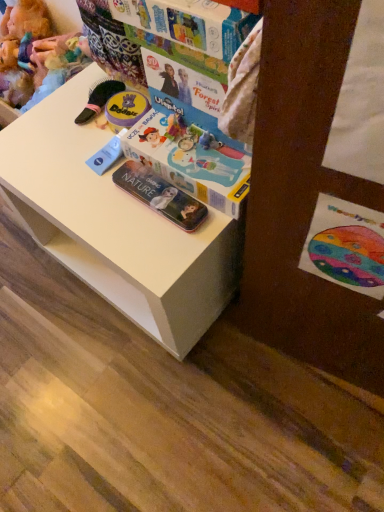
Question: From a real-world perspective, is multicolored cardboard book at upper center on transparent plastic case at lower center?

Choices:
 (A) no
 (B) yes

Answer: (B)

Question: From a real-world perspective, does multicolored cardboard book at upper center sit lower than transparent plastic case at lower center?

Choices:
 (A) no
 (B) yes

Answer: (A)

Question: Is multicolored cardboard book at upper center placed right next to transparent plastic case at lower center?

Choices:
 (A) yes
 (B) no

Answer: (B)

Question: Would you consider multicolored cardboard book at upper center to be distant from transparent plastic case at lower center?

Choices:
 (A) no
 (B) yes

Answer: (A)

Question: Considering the relative sizes of multicolored cardboard book at upper center and transparent plastic case at lower center in the image provided, is multicolored cardboard book at upper center shorter than transparent plastic case at lower center?

Choices:
 (A) no
 (B) yes

Answer: (A)

Question: Considering their positions, is multicolored cardboard book at upper center located in front of or behind transparent plastic case at lower center?

Choices:
 (A) behind
 (B) front

Answer: (B)

Question: Which is correct: multicolored cardboard book at upper center is inside transparent plastic case at lower center, or outside of it?

Choices:
 (A) outside
 (B) inside

Answer: (A)

Question: Is point (226, 12) closer or farther from the camera than point (147, 187)?

Choices:
 (A) closer
 (B) farther

Answer: (A)

Question: From the image's perspective, is multicolored cardboard book at upper center positioned above or below transparent plastic case at lower center?

Choices:
 (A) below
 (B) above

Answer: (B)

Question: From a real-world perspective, is white plastic changing table at center above or below multicolored cardboard book at upper center?

Choices:
 (A) below
 (B) above

Answer: (A)

Question: From the image's perspective, relative to multicolored cardboard book at upper center, is white plastic changing table at center above or below?

Choices:
 (A) below
 (B) above

Answer: (A)

Question: Is white plastic changing table at center in front of or behind multicolored cardboard book at upper center in the image?

Choices:
 (A) front
 (B) behind

Answer: (B)

Question: Based on their sizes in the image, would you say white plastic changing table at center is bigger or smaller than multicolored cardboard book at upper center?

Choices:
 (A) small
 (B) big

Answer: (B)

Question: In terms of size, does fuzzy fabric doll at upper left appear bigger or smaller than watercolor paper postcard at lower right?

Choices:
 (A) small
 (B) big

Answer: (B)

Question: Is point (29, 51) positioned closer to the camera than point (329, 236)?

Choices:
 (A) closer
 (B) farther

Answer: (B)